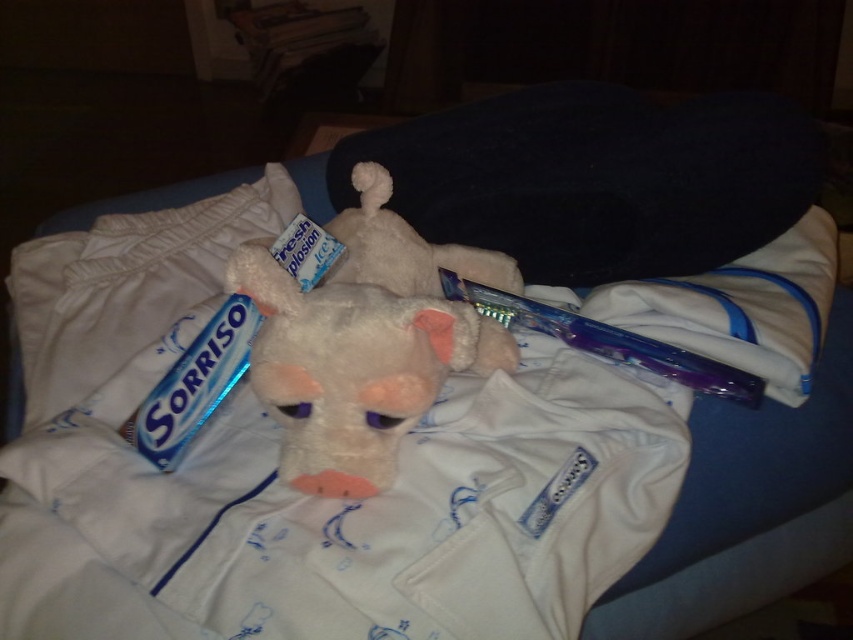
Does blue metallic toothpaste at lower left lie in front of purple glossy toothbrush at center?

Yes.

Who is shorter, blue metallic toothpaste at lower left or purple glossy toothbrush at center?

purple glossy toothbrush at center is shorter.

Is point (218, 374) closer to viewer compared to point (584, 320)?

Yes, point (218, 374) is in front of point (584, 320).

Find the location of `blue metallic toothpaste at lower left`. blue metallic toothpaste at lower left is located at coordinates (194, 384).

What do you see at coordinates (352, 369) in the screenshot? I see `fluffy white plush toy at center` at bounding box center [352, 369].

Can you confirm if fluffy white plush toy at center is wider than blue metallic toothpaste at lower left?

Correct, the width of fluffy white plush toy at center exceeds that of blue metallic toothpaste at lower left.

Between point (343, 381) and point (181, 452), which one is positioned behind?

The point (181, 452) is more distant.

Identify the location of fluffy white plush toy at center. (352, 369).

Does point (428, 346) come behind point (497, 312)?

No, (428, 346) is in front of (497, 312).

Which of these two, fluffy white plush toy at center or purple glossy toothbrush at center, stands shorter?

Standing shorter between the two is purple glossy toothbrush at center.

Measure the distance between fluffy white plush toy at center and camera.

23.21 inches

Image resolution: width=853 pixels, height=640 pixels. Find the location of `fluffy white plush toy at center`. fluffy white plush toy at center is located at coordinates (352, 369).